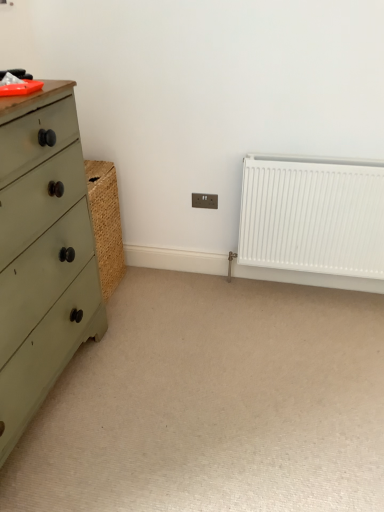
You are a GUI agent. You are given a task and a screenshot of the screen. Output one action in this format:
    pyautogui.click(x=<x>, y=<y>)
    Task: Click on the blank area beneath white matte radiator at right (from a real-world perspective)
    
    Given the screenshot: What is the action you would take?
    pyautogui.click(x=297, y=288)